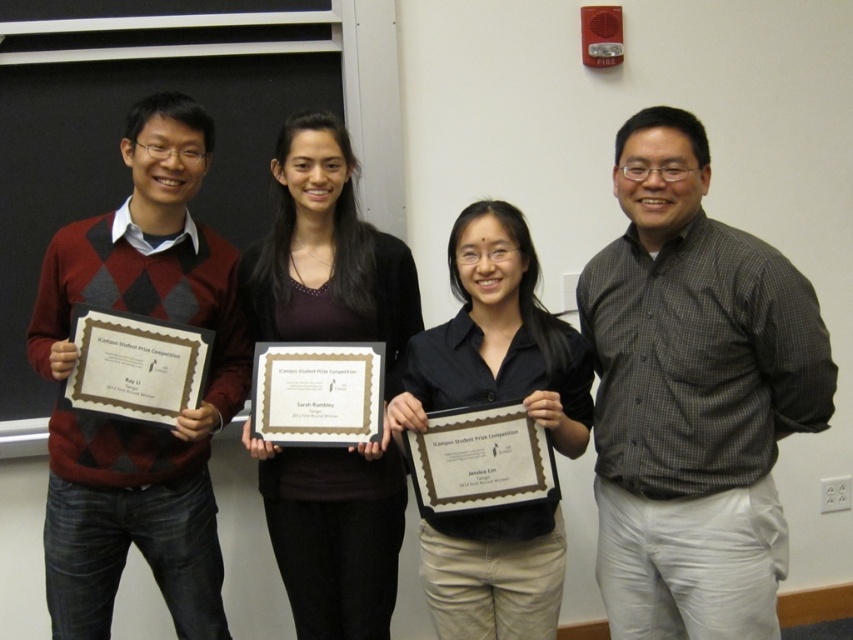
Question: Which is farther from the gold paper certificate at center?

Choices:
 (A) argyle sweater at left
 (B) matte black certificate at left
 (C) matte gold certificate at left
 (D) matte black plaque at center

Answer: (B)

Question: Does gray checkered shirt at center lie in front of argyle sweater at left?

Choices:
 (A) no
 (B) yes

Answer: (B)

Question: Can you confirm if gray checkered shirt at center is positioned above matte gold certificate at left?

Choices:
 (A) yes
 (B) no

Answer: (B)

Question: Which of the following is the closest to the observer?

Choices:
 (A) matte black certificate at left
 (B) gold paper certificate at center
 (C) gray checkered shirt at center

Answer: (C)

Question: Is argyle sweater at left behind matte black plaque at center?

Choices:
 (A) yes
 (B) no

Answer: (A)

Question: Which object appears farthest from the camera in this image?

Choices:
 (A) matte black certificate at left
 (B) gold paper certificate at center
 (C) gray checkered shirt at center

Answer: (A)